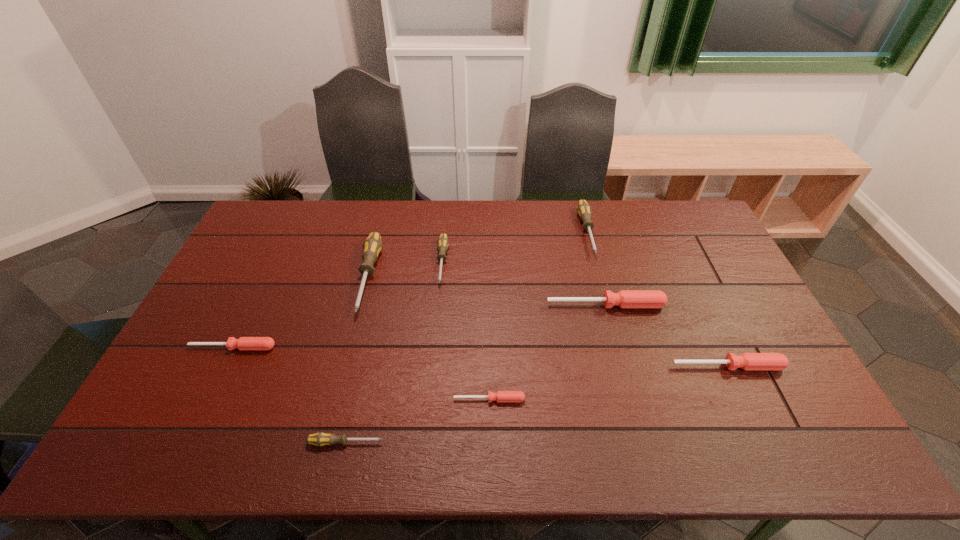
Image resolution: width=960 pixels, height=540 pixels. I want to click on vacant space located 0.240m at the tip of the smallest gray screwdriver, so click(486, 442).

The height and width of the screenshot is (540, 960). Identify the location of free space located 0.370m on the right of the second red screwdriver from left to right. (670, 399).

Locate an element on the screen. Image resolution: width=960 pixels, height=540 pixels. object located at the near edge is located at coordinates (319, 439).

Locate an element on the screen. This screenshot has width=960, height=540. object that is at the left edge is located at coordinates (243, 343).

The height and width of the screenshot is (540, 960). Identify the location of object at the right edge. (747, 361).

Identify the location of vacant space at the far edge of the desktop. (623, 207).

The image size is (960, 540). What are the coordinates of `vacant space at the near edge of the desktop` in the screenshot? It's located at (253, 431).

In the image, there is a desktop. Where is `vacant space at the left edge`? The height and width of the screenshot is (540, 960). vacant space at the left edge is located at coordinates (222, 368).

You are a GUI agent. You are given a task and a screenshot of the screen. Output one action in this format:
    pyautogui.click(x=<x>, y=<y>)
    Task: Click on the vacant position at the right edge of the desktop
    Image resolution: width=960 pixels, height=540 pixels.
    Given the screenshot: What is the action you would take?
    pyautogui.click(x=681, y=260)

This screenshot has height=540, width=960. In order to click on vacant area at the far left corner in this screenshot , I will do `click(294, 200)`.